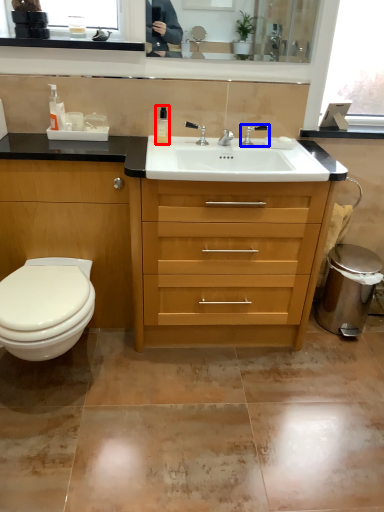
Question: Which object is further to the camera taking this photo, toiletry (highlighted by a red box) or tap (highlighted by a blue box)?

Choices:
 (A) toiletry
 (B) tap

Answer: (B)